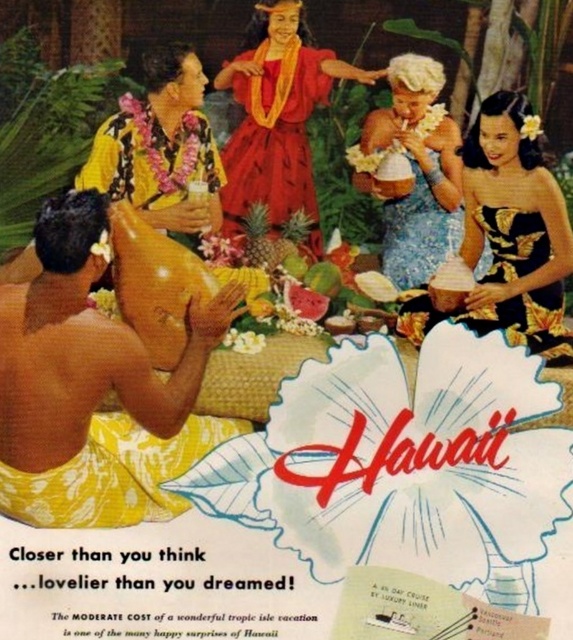
You are standing at the point marked by coordinates point (61,483) in the vintage Hawaiian advertisement scene. You want to greet a friend who is standing 5 meters away from you. Is your friend within reach if you can only move 4 meters forward?

The distance between you and the viewer is 4.74 meters. Since you can only move 4 meters forward, you cannot reach your friend who is 5 meters away.

Based on the scene description, what are the coordinates of the yellow woven cloth at left?

The yellow woven cloth at left is located at coordinates point (95, 387).

You are a tourist in Hawaii and want to take a photo with the two men in yellow sarongs and the woman in the red dress with a lei. You are standing at point A, which is at coordinates point [319,49]. You want to move to point B at coordinates point [422,262] to get a better angle. Will moving from point A to point B bring you closer to the two men in yellow sarongs?

Point [319,49] is in front of point [422,262]. Moving from point A to point B would take you further away from the two men in yellow sarongs since point A is already closer to them.